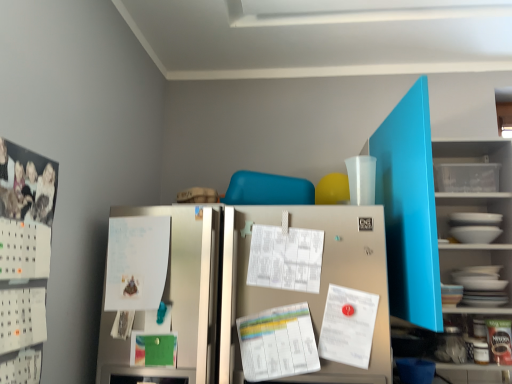
Question: Is white paper at center, the 1th paper in the left-to-right sequence, bigger or smaller than white paper at center, which appears as the second paper when viewed from the right?

Choices:
 (A) small
 (B) big

Answer: (B)

Question: Looking at their shapes, would you say white paper at center, the 1th paper in the left-to-right sequence, is wider or thinner than white paper at center, which appears as the second paper when viewed from the right?

Choices:
 (A) wide
 (B) thin

Answer: (A)

Question: Which is farther from the matte blue bookshelf at upper right?

Choices:
 (A) white paper at center, placed as the 3th paper when sorted from left to right
 (B) white glossy bowls at right
 (C) white paper at center, which appears as the second paper when viewed from the right
 (D) satin silver refrigerator at center
 (E) white paper at center, the 1th paper in the left-to-right sequence

Answer: (E)

Question: Estimate the real-world distances between objects in this image. Which object is closer to the satin silver refrigerator at center?

Choices:
 (A) white glossy bowls at right
 (B) matte blue bookshelf at upper right
 (C) white paperboard at left
 (D) white paper at center, marked as the first paper in a right-to-left arrangement
 (E) white paper at center, the 2th paper from the left

Answer: (E)